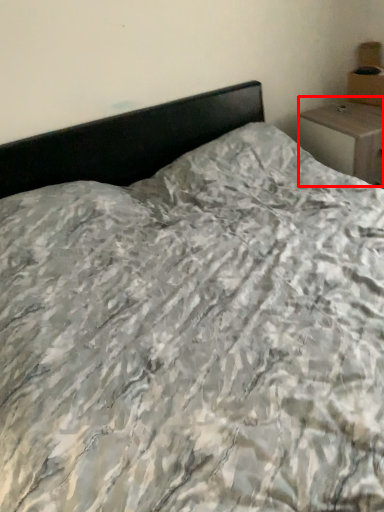
Question: From the image's perspective, what is the correct spatial positioning of nightstand (annotated by the red box) in reference to cardboard box?

Choices:
 (A) below
 (B) above

Answer: (A)